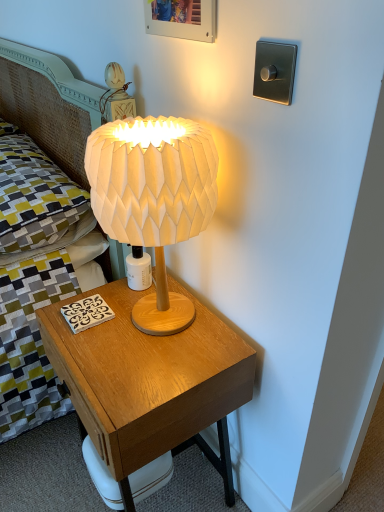
The height and width of the screenshot is (512, 384). Find the location of `free space to the left of white paper lampshade at center`. free space to the left of white paper lampshade at center is located at coordinates (85, 326).